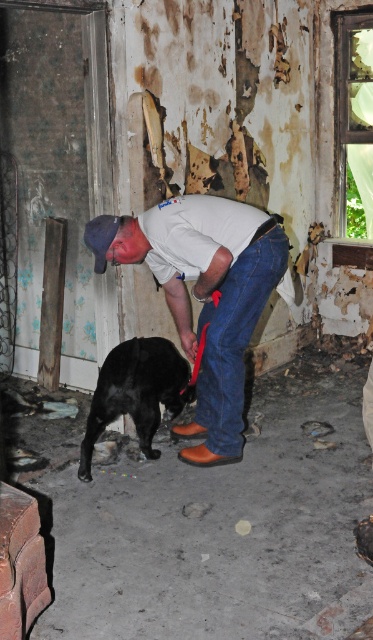
Based on the scene description, where is the white matte shirt at center in relation to the black matte dog at lower left?

The white matte shirt at center is to the right of the black matte dog at lower left.